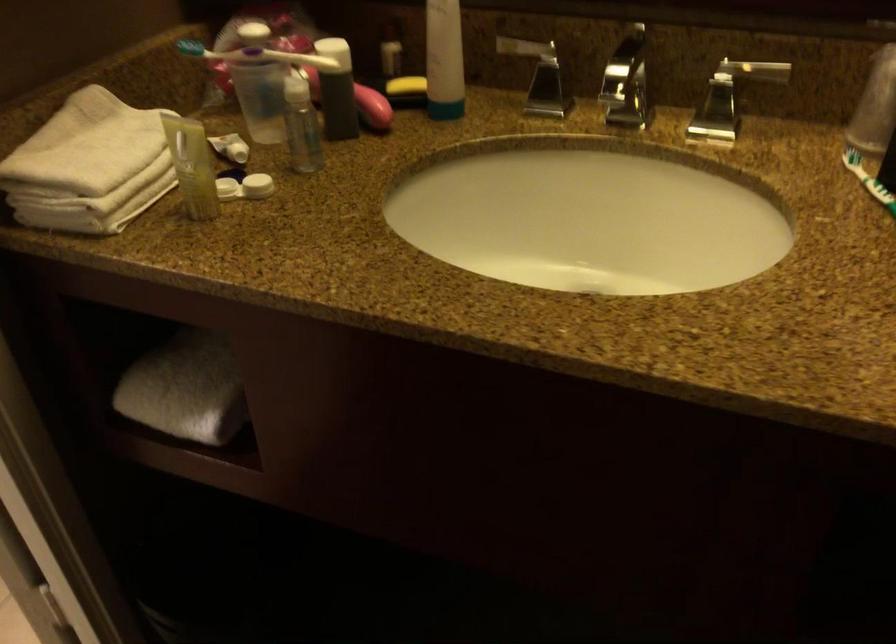
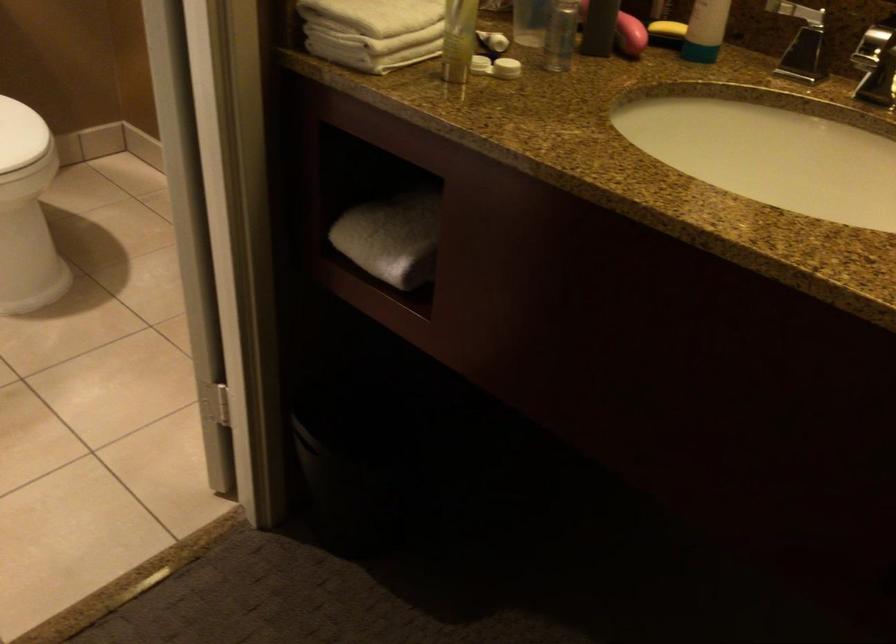
In the second image, find the point that corresponds to point (188, 391) in the first image.

(392, 238)